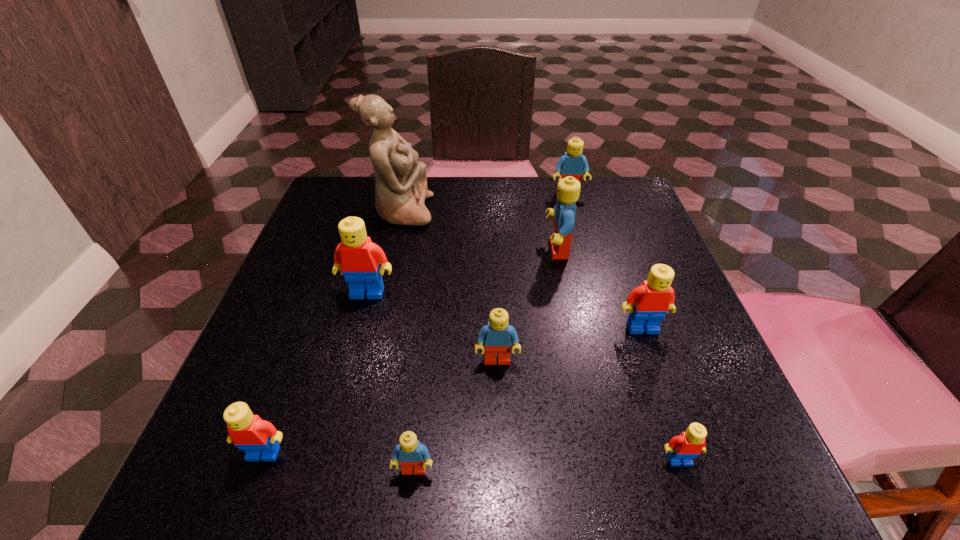
This screenshot has height=540, width=960. Identify the location of the fourth closest red Lego to the second blue Lego from left to right. (258, 438).

Locate an element on the screen. The width and height of the screenshot is (960, 540). vacant space that satisfies the following two spatial constraints: 1. on the face of the third smallest blue Lego; 2. on the front-facing side of the white figurine is located at coordinates (573, 212).